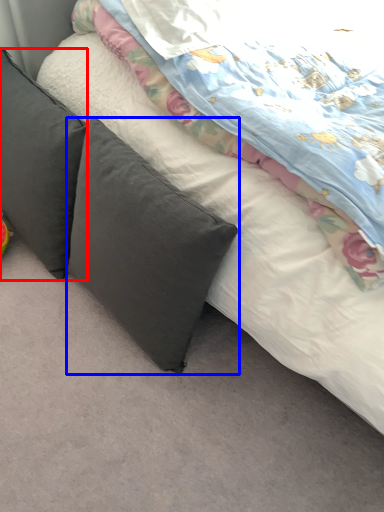
Question: Which point is further to the camera, pillow (highlighted by a red box) or pillow (highlighted by a blue box)?

Choices:
 (A) pillow
 (B) pillow

Answer: (A)